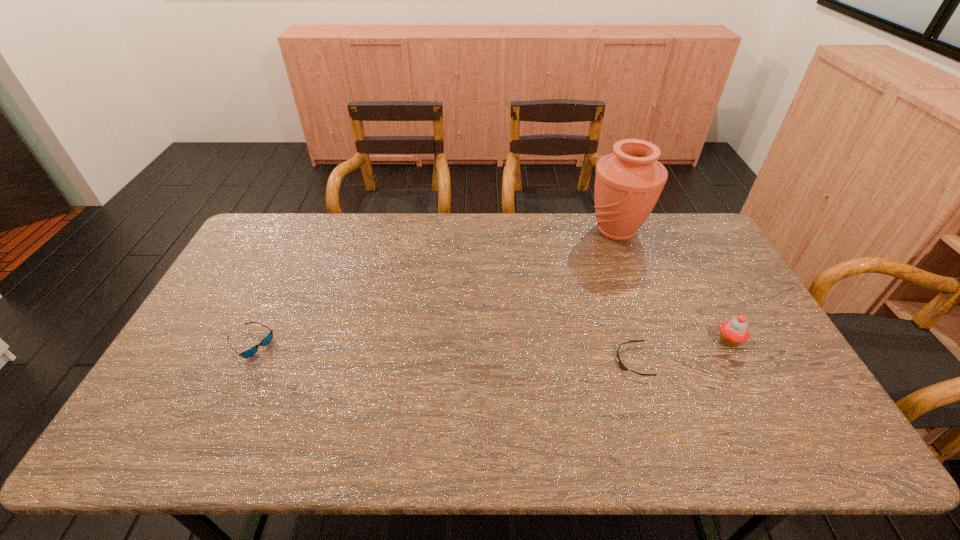
You are a GUI agent. You are given a task and a screenshot of the screen. Output one action in this format:
    pyautogui.click(x=<x>, y=<y>)
    Task: Click on the vacant space positioned 0.120m at the front of the taller sunglasses showing the lenses
    
    Given the screenshot: What is the action you would take?
    pyautogui.click(x=316, y=344)

At what (x,y) coordinates should I click in order to perform the action: click on free point located on the front-facing side of the shortest object. Please return your answer as a coordinate pair (x, y). This screenshot has width=960, height=540. Looking at the image, I should click on (580, 361).

Where is `vacant space located 0.240m on the front-facing side of the shortest object`? The height and width of the screenshot is (540, 960). vacant space located 0.240m on the front-facing side of the shortest object is located at coordinates (528, 361).

This screenshot has width=960, height=540. In order to click on vacant space located on the front-facing side of the shortest object in this screenshot , I will do `click(562, 361)`.

Identify the location of object at the far edge. (628, 183).

Identify the location of object located in the left edge section of the desktop. Image resolution: width=960 pixels, height=540 pixels. (250, 352).

Find the location of a particular element. The height and width of the screenshot is (540, 960). object present at the right edge is located at coordinates (734, 332).

This screenshot has height=540, width=960. What are the coordinates of `vacant area at the far edge of the desktop` in the screenshot? It's located at (469, 252).

This screenshot has height=540, width=960. In the image, there is a desktop. In order to click on vacant space at the near edge in this screenshot , I will do `click(559, 423)`.

Find the location of `vacant space at the left edge of the desktop`. vacant space at the left edge of the desktop is located at coordinates (240, 296).